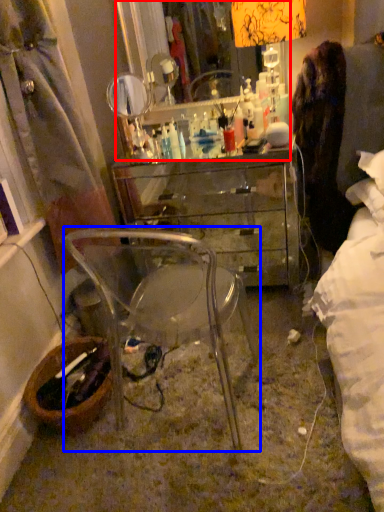
Question: Which of the following is the closest to the observer, mirror (highlighted by a red box) or chair (highlighted by a blue box)?

Choices:
 (A) mirror
 (B) chair

Answer: (B)